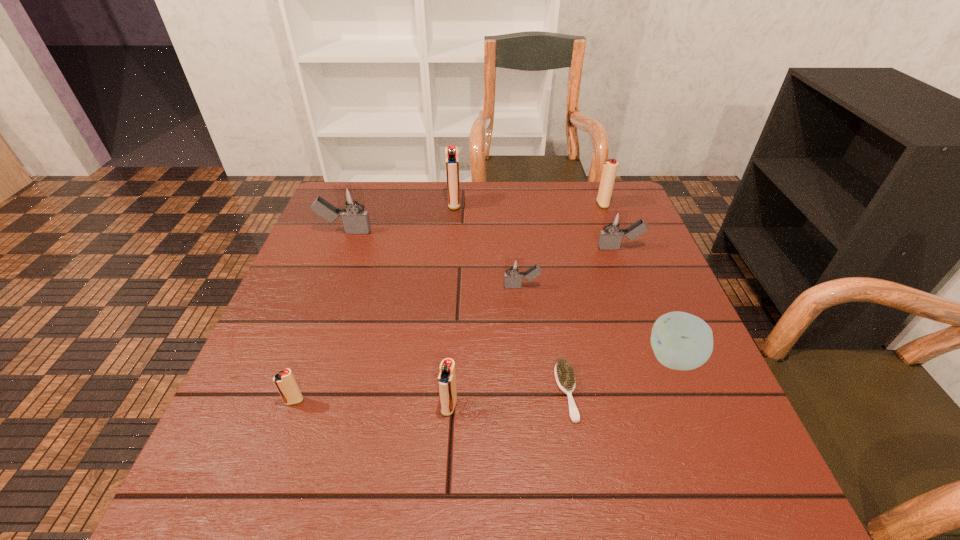
Identify the location of free spot between the second gray igniter from right to left and the second biggest red igniter. (563, 246).

Where is `vacant area that lies between the leftmost red igniter and the apple`? vacant area that lies between the leftmost red igniter and the apple is located at coordinates (485, 380).

This screenshot has width=960, height=540. What are the coordinates of `empty location between the third biggest red igniter and the fifth object from left to right` in the screenshot? It's located at (486, 347).

Locate an element on the screen. The width and height of the screenshot is (960, 540). vacant space that is in between the apple and the fourth object from right to left is located at coordinates (620, 375).

Locate an element on the screen. Image resolution: width=960 pixels, height=540 pixels. unoccupied area between the leftmost red igniter and the leftmost gray igniter is located at coordinates tap(320, 316).

Locate an element on the screen. The height and width of the screenshot is (540, 960). empty location between the seventh nearest object and the fifth object from left to right is located at coordinates (434, 259).

Find the location of `empty location between the biggest gray igniter and the third biggest red igniter`. empty location between the biggest gray igniter and the third biggest red igniter is located at coordinates (396, 319).

You are a GUI agent. You are given a task and a screenshot of the screen. Output one action in this format:
    pyautogui.click(x=<x>, y=<y>)
    Task: Click on the free space between the tallest object and the second biggest gray igniter
    
    Given the screenshot: What is the action you would take?
    pyautogui.click(x=537, y=226)

Where is `free spot between the leftmost red igniter and the second smallest red igniter`? This screenshot has width=960, height=540. free spot between the leftmost red igniter and the second smallest red igniter is located at coordinates (372, 403).

Where is `free space that is in between the sixth nearest object and the fifth nearest object`? This screenshot has height=540, width=960. free space that is in between the sixth nearest object and the fifth nearest object is located at coordinates (571, 267).